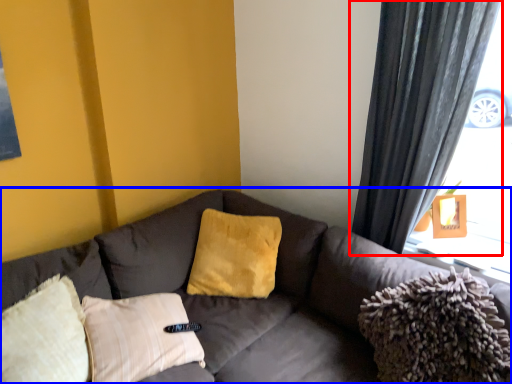
Question: Which of the following is the closest to the observer, curtain (highlighted by a red box) or studio couch (highlighted by a blue box)?

Choices:
 (A) curtain
 (B) studio couch

Answer: (B)